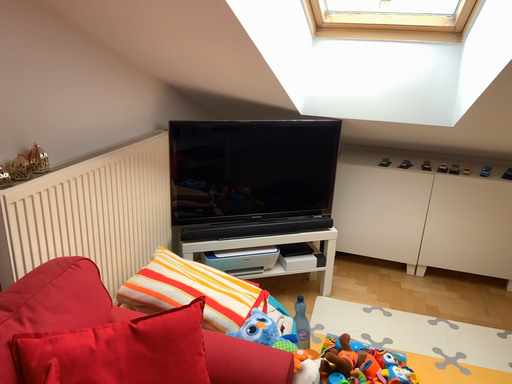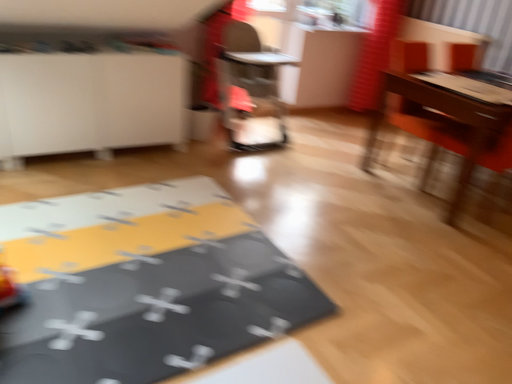
Question: Which way did the camera rotate in the video?

Choices:
 (A) rotated right
 (B) rotated left

Answer: (A)